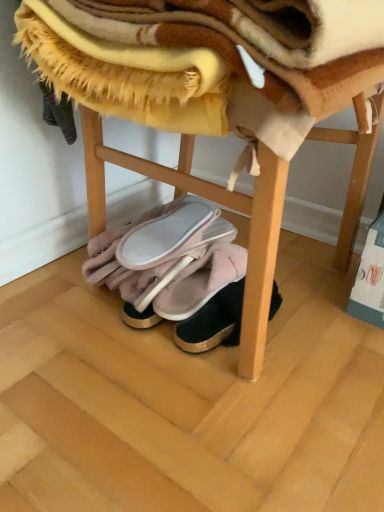
Question: From a real-world perspective, is velvet pink slippers at center, arranged as the 4th footwear when viewed from the left, positioned above or below pink fluffy slippers at lower center, the fourth footwear positioned from the right?

Choices:
 (A) above
 (B) below

Answer: (B)

Question: Is point (220, 296) closer or farther from the camera than point (203, 347)?

Choices:
 (A) closer
 (B) farther

Answer: (B)

Question: Which of these objects is positioned closest to the pink fluffy slippers at lower center, the fourth footwear positioned from the right?

Choices:
 (A) pink suede slippers at lower center, acting as the 3th footwear starting from the left
 (B) velvet pink slippers at center, which is counted as the 1th footwear, starting from the right
 (C) wooden stool at lower center
 (D) fuzzy yellow blanket at upper center
 (E) pink fuzzy slippers at center, the third footwear viewed from the right

Answer: (E)

Question: Estimate the real-world distances between objects in this image. Which object is farther from the wooden stool at lower center?

Choices:
 (A) pink suede slippers at lower center, the 2th footwear when ordered from right to left
 (B) fuzzy yellow blanket at upper center
 (C) pink fluffy slippers at lower center, the fourth footwear positioned from the right
 (D) velvet pink slippers at center, arranged as the 4th footwear when viewed from the left
 (E) pink fuzzy slippers at center, arranged as the second footwear when viewed from the left

Answer: (D)